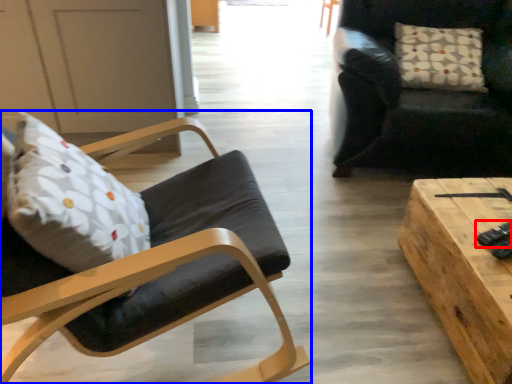
Question: Which point is further to the camera, remote control (highlighted by a red box) or chair (highlighted by a blue box)?

Choices:
 (A) remote control
 (B) chair

Answer: (A)